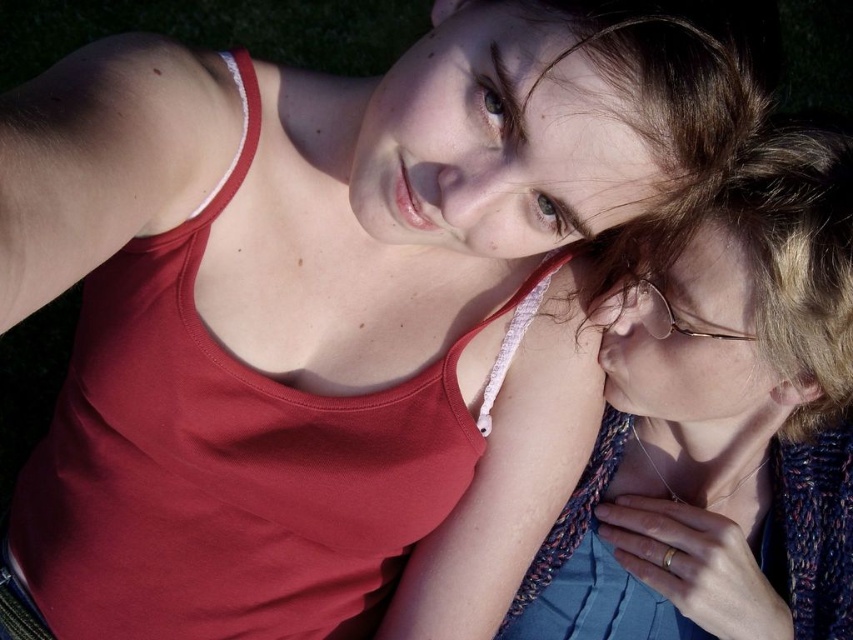
Question: Is knitted blue sweater at right thinner than green grass at upper left?

Choices:
 (A) yes
 (B) no

Answer: (A)

Question: Does knitted blue sweater at right have a lesser width compared to green grass at upper left?

Choices:
 (A) yes
 (B) no

Answer: (A)

Question: Does knitted blue sweater at right have a lesser width compared to green grass at upper left?

Choices:
 (A) yes
 (B) no

Answer: (A)